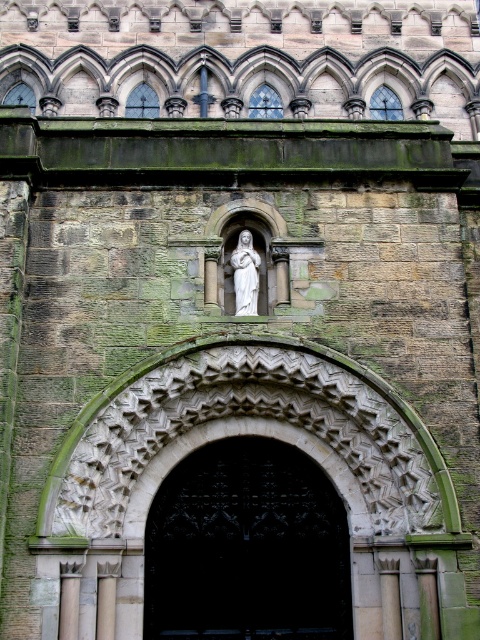
You are standing in front of the stone structure and want to enter through the black wrought iron gate at center. However, there is a white marble statue at center blocking your path. Can you walk around the statue to reach the gate?

The black wrought iron gate at center is to the left of the white marble statue at center, so you can walk around the statue to the left side to reach the gate.

From the picture: You are a visitor approaching the stone structure and see the black wrought iron gate at center and the white marble statue at center. Which object is wider from your perspective?

The black wrought iron gate at center is wider than the white marble statue at center.

You are standing in front of the stone structure and see a point marked at coordinates (247, 547). Based on the scene description, can you identify what object this point is located on?

The point at coordinates (247, 547) is located on the black wrought iron gate at center.